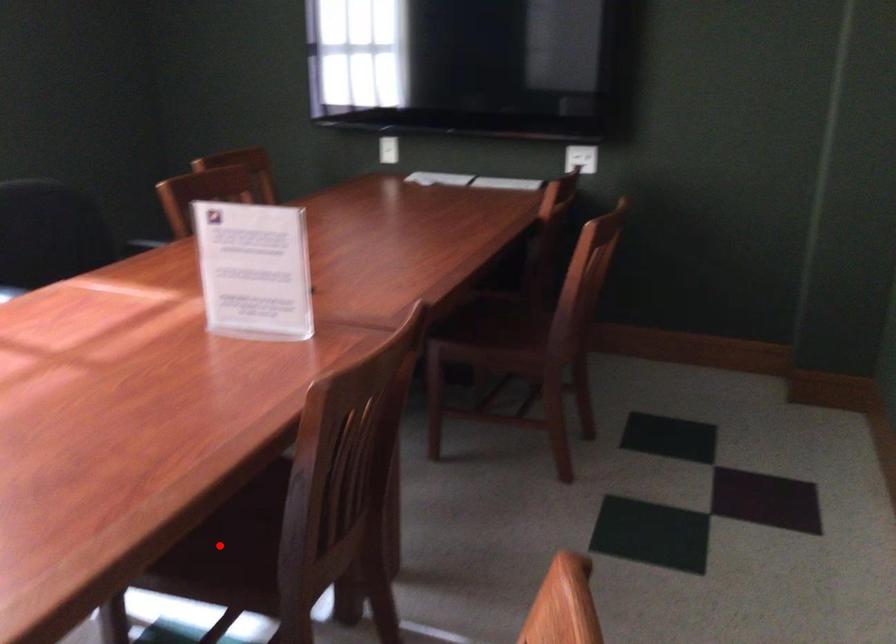
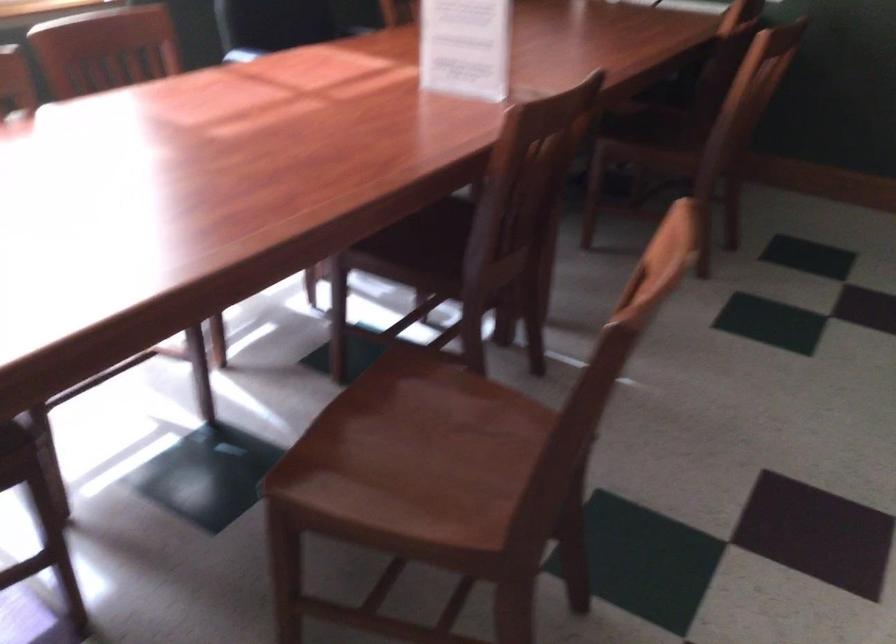
Where in the second image is the point corresponding to the highlighted location from the first image?

(418, 247)